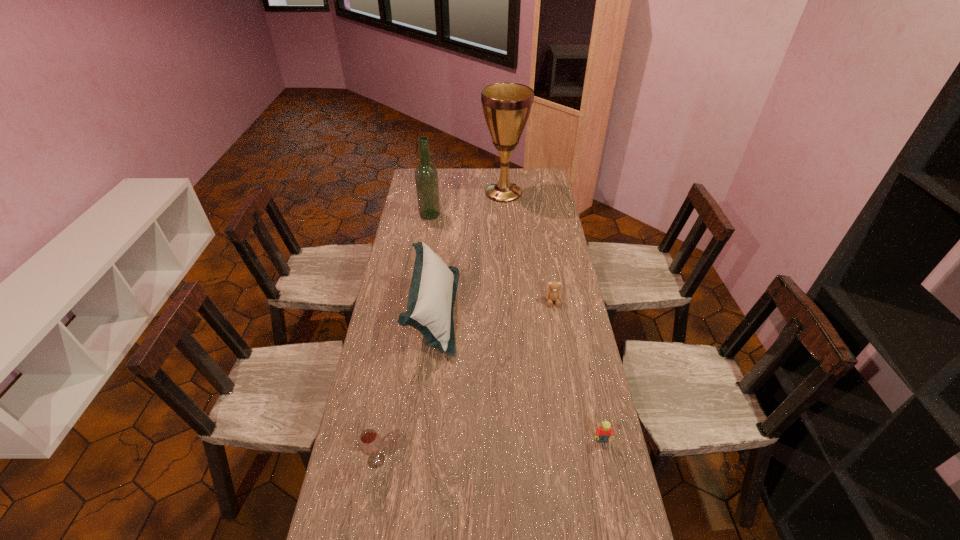
In order to click on free area in between the trophy cup and the teddy bear in this screenshot , I will do `click(528, 247)`.

You are a GUI agent. You are given a task and a screenshot of the screen. Output one action in this format:
    pyautogui.click(x=<x>, y=<y>)
    Task: Click on the vacant space that's between the wineglass and the cushion
    The image size is (960, 540).
    Given the screenshot: What is the action you would take?
    pyautogui.click(x=405, y=386)

I want to click on vacant area between the wineglass and the second farthest object, so click(403, 338).

Where is `free space between the third tallest object and the rightmost object`? The image size is (960, 540). free space between the third tallest object and the rightmost object is located at coordinates (517, 376).

Locate which object ranks third in proximity to the fifth object from left to right. Please provide its 2D coordinates. Your answer should be formatted as a tuple, i.e. [(x, y)], where the tuple contains the x and y coordinates of a point satisfying the conditions above.

[(506, 106)]

Identify which object is located as the second nearest to the rightmost object. Please provide its 2D coordinates. Your answer should be formatted as a tuple, i.e. [(x, y)], where the tuple contains the x and y coordinates of a point satisfying the conditions above.

[(553, 294)]